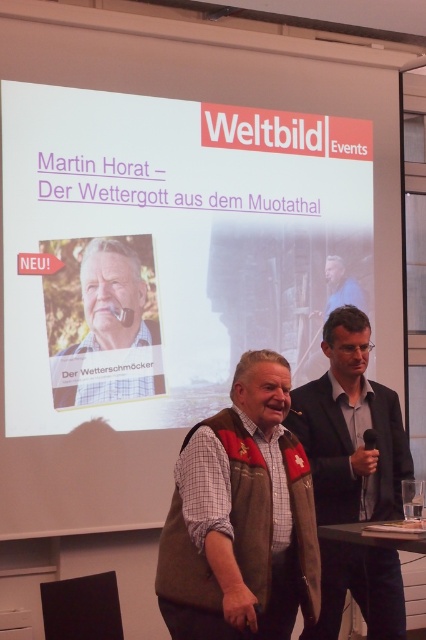
You are standing at the camera position and want to see the entire white matte projector screen at upper center. Given that your field of view is 60 degrees, can you see the entire screen without moving?

The white matte projector screen at upper center and camera are 12.73 feet apart. Based on the distance and field of view, you can see the entire screen without moving.

You are a photographer setting up for an event. You have a camera that needs to be placed at a distance of at least 3.5 meters from the white matte projector screen at upper center to avoid glare. Is the current placement of the camera meeting this requirement?

The white matte projector screen at upper center and camera are 3.88 meters apart, so yes, the current placement of the camera meets the requirement as it is more than 3.5 meters away.

You are an attendee at the presentation. The presenter is pointing to the white matte projector screen at upper center and the matte brown vest at center. Which object is closer to you?

The white matte projector screen at upper center is closer to you than the matte brown vest at center.